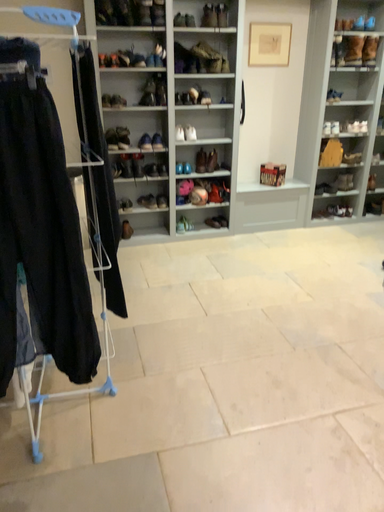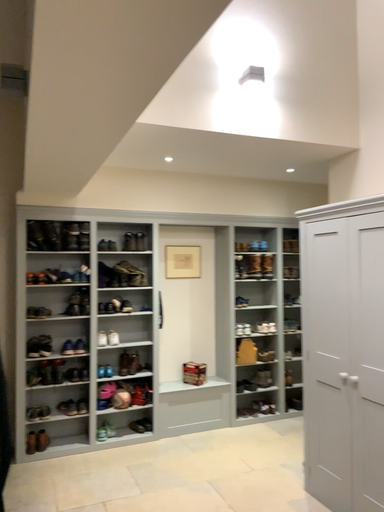
Question: Which way did the camera rotate in the video?

Choices:
 (A) rotated upward
 (B) rotated downward

Answer: (A)